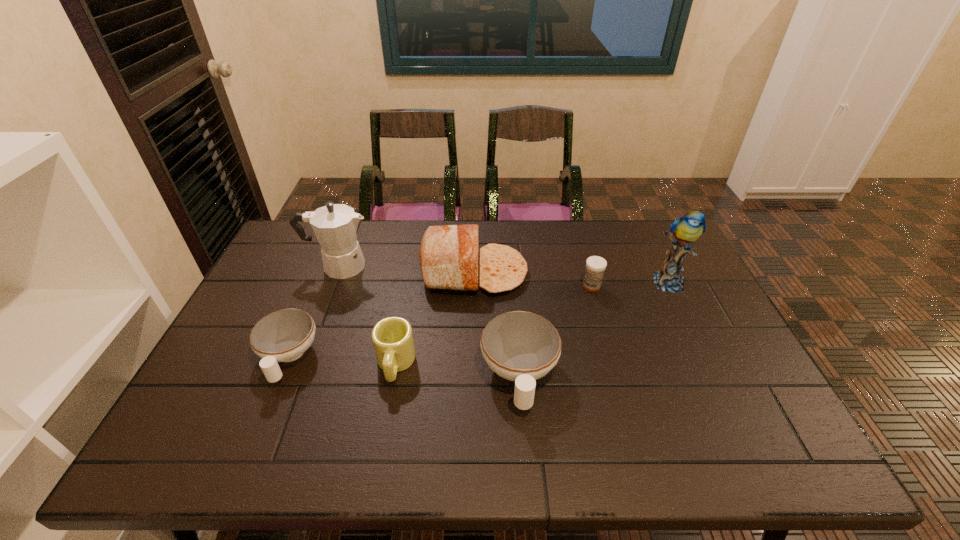
In the image, there is a desktop. At what (x,y) coordinates should I click in order to perform the action: click on free space at the far edge. Please return your answer as a coordinate pair (x, y). The image size is (960, 540). Looking at the image, I should click on (629, 239).

Locate an element on the screen. vacant region at the near edge of the desktop is located at coordinates (573, 400).

At what (x,y) coordinates should I click in order to perform the action: click on free space at the left edge. Please return your answer as a coordinate pair (x, y). The height and width of the screenshot is (540, 960). Looking at the image, I should click on 233,349.

In the image, there is a desktop. What are the coordinates of `free region at the right edge` in the screenshot? It's located at (707, 377).

In the image, there is a desktop. At what (x,y) coordinates should I click in order to perform the action: click on vacant space at the near left corner. Please return your answer as a coordinate pair (x, y). Looking at the image, I should click on 251,411.

At what (x,y) coordinates should I click in order to perform the action: click on unoccupied position between the medicine and the third tallest object. Please return your answer as a coordinate pair (x, y). Looking at the image, I should click on (533, 279).

Identify the location of free spot between the mug and the left chinaware. This screenshot has width=960, height=540. (342, 361).

The height and width of the screenshot is (540, 960). In order to click on vacant area that lies between the medicine and the third tallest object in this screenshot , I will do `click(533, 279)`.

This screenshot has height=540, width=960. I want to click on free space between the medicine and the rightmost object, so click(630, 284).

Identify the location of blank region between the coffeepot and the shorter chinaware. Image resolution: width=960 pixels, height=540 pixels. (313, 312).